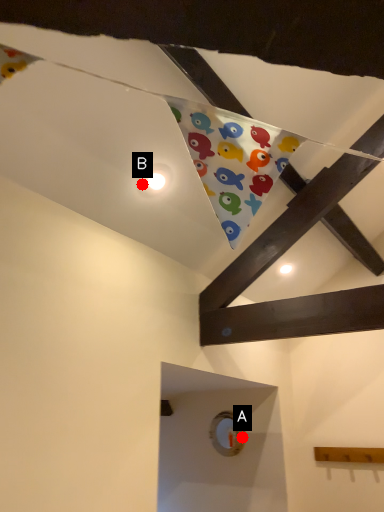
Question: Two points are circled on the image, labeled by A and B beside each circle. Which point is farther from the camera taking this photo?

Choices:
 (A) A is further
 (B) B is further

Answer: (A)